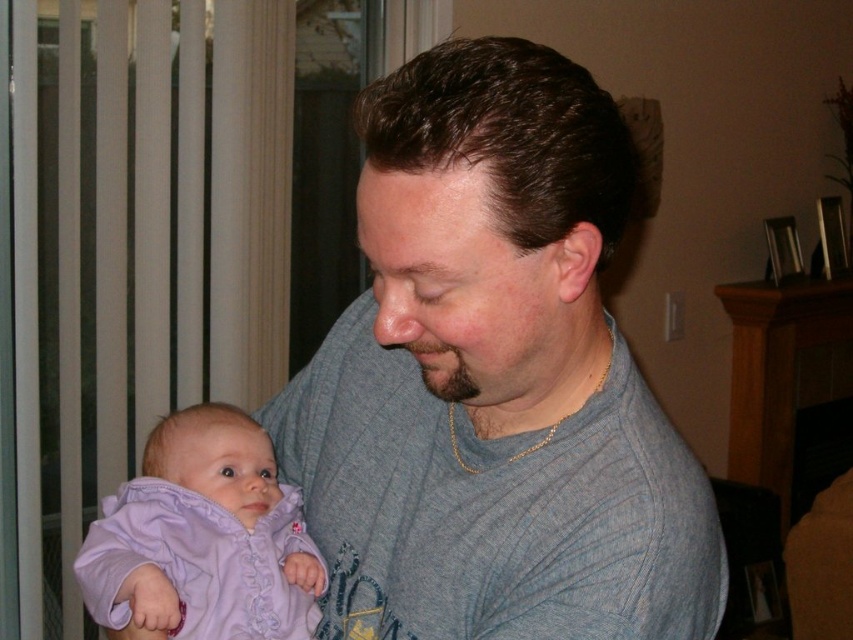
You are standing in the room and want to place a small plant between the two points, point 1 at (485, 419) and point 2 at (165, 513). Which point should the plant be closer to in order to be in front of the other point?

The plant should be closer to point 1 at (485, 419) because it is in front of point 2 at (165, 513).

You are a photographer setting up for a family portrait. You need to ensure that both the gray knit sweater at center and the lavender soft fabric baby at left are clearly visible in the photo. Given their positions, which object should you focus on first to ensure both are in focus?

The gray knit sweater at center is in front of the lavender soft fabric baby at left, so you should focus on the gray knit sweater at center first to ensure both are in focus.

You are a photographer setting up a shoot in this scene. You need to ensure that the gray knit sweater at center and the lavender soft fabric baby at left are both in focus. Given that your camera can only focus on objects within a 1.2 meter width, will both objects fit within this focus range?

The gray knit sweater at center is wider than the lavender soft fabric baby at left. Since the camera can focus on objects within a 1.2 meter width, both objects can fit within this range as long as their combined width does not exceed 1.2 meters. However, the exact fit depends on their individual widths and positioning in the scene.